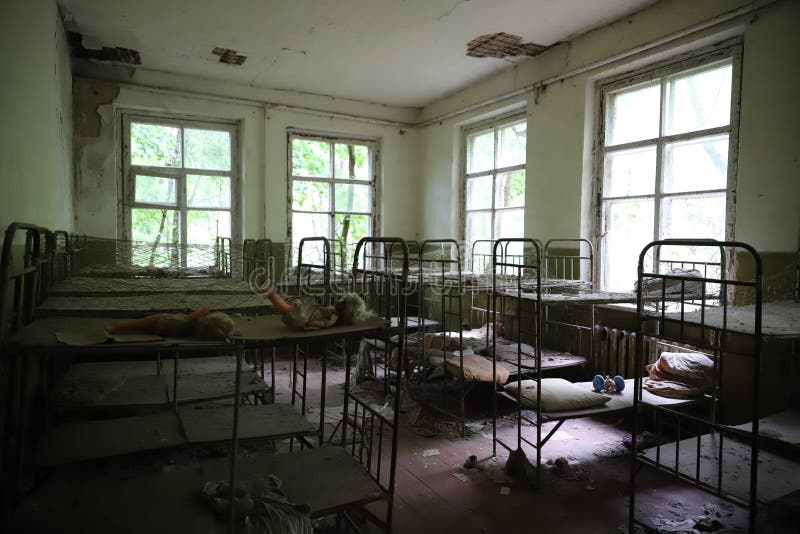
The width and height of the screenshot is (800, 534). I want to click on floor, so click(438, 456).